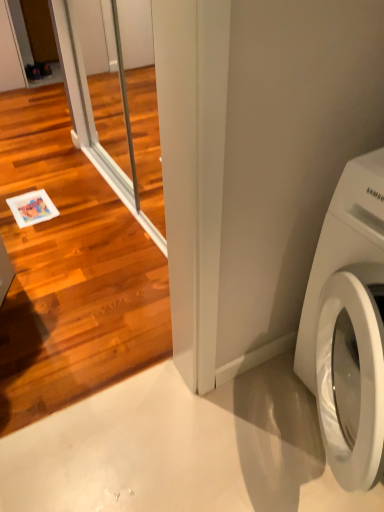
Where is `white glossy washing machine at lower right`? The height and width of the screenshot is (512, 384). white glossy washing machine at lower right is located at coordinates (348, 326).

Where is `clear glass screen door at left, positioned as the first screen door in back-to-front order`? clear glass screen door at left, positioned as the first screen door in back-to-front order is located at coordinates (115, 100).

Find the location of a particular element. This screenshot has width=384, height=512. white glossy washing machine at lower right is located at coordinates (348, 326).

From the picture: Is clear glass screen door at upper left, the 1th screen door positioned from the front, oriented away from clear glass screen door at left, arranged as the second screen door when viewed from the front?

Absolutely, clear glass screen door at upper left, the 1th screen door positioned from the front, is directed away from clear glass screen door at left, arranged as the second screen door when viewed from the front.

Which is nearer, (x=139, y=336) or (x=120, y=134)?

Point (x=139, y=336)

Looking at this image, considering the relative positions of clear glass screen door at upper left, which ranks as the second screen door in back-to-front order, and clear glass screen door at left, positioned as the first screen door in back-to-front order, in the image provided, is clear glass screen door at upper left, which ranks as the second screen door in back-to-front order, behind clear glass screen door at left, positioned as the first screen door in back-to-front order,?

No, clear glass screen door at upper left, which ranks as the second screen door in back-to-front order, is in front of clear glass screen door at left, positioned as the first screen door in back-to-front order.

Could you tell me if white glossy washing machine at lower right is turned towards clear glass screen door at left, positioned as the first screen door in back-to-front order?

No, white glossy washing machine at lower right is not oriented towards clear glass screen door at left, positioned as the first screen door in back-to-front order.

Is point (319, 373) positioned behind point (149, 116)?

That is False.

Is white glossy washing machine at lower right in contact with clear glass screen door at left, arranged as the second screen door when viewed from the front?

No.

Which of these two, white glossy washing machine at lower right or clear glass screen door at left, arranged as the second screen door when viewed from the front, is wider?

Wider between the two is white glossy washing machine at lower right.

From the image's perspective, is clear glass screen door at left, arranged as the second screen door when viewed from the front, located above or below clear glass screen door at upper left, the 1th screen door positioned from the front?

Based on their image positions, clear glass screen door at left, arranged as the second screen door when viewed from the front, is located above clear glass screen door at upper left, the 1th screen door positioned from the front.

Which object is closer to the camera, clear glass screen door at left, arranged as the second screen door when viewed from the front, or clear glass screen door at upper left, which ranks as the second screen door in back-to-front order?

clear glass screen door at upper left, which ranks as the second screen door in back-to-front order, is more forward.

Is clear glass screen door at left, arranged as the second screen door when viewed from the front, far from clear glass screen door at upper left, which ranks as the second screen door in back-to-front order?

No.

Is white glossy washing machine at lower right at the back of clear glass screen door at upper left, the 1th screen door positioned from the front?

No, clear glass screen door at upper left, the 1th screen door positioned from the front,'s orientation is not away from white glossy washing machine at lower right.

From a real-world perspective, relative to white glossy washing machine at lower right, is clear glass screen door at upper left, which ranks as the second screen door in back-to-front order, vertically above or below?

clear glass screen door at upper left, which ranks as the second screen door in back-to-front order, is above white glossy washing machine at lower right.

Which is in front, point (3, 198) or point (346, 272)?

Positioned in front is point (346, 272).

Which object is positioned more to the right, clear glass screen door at upper left, the 1th screen door positioned from the front, or white glossy washing machine at lower right?

Positioned to the right is white glossy washing machine at lower right.

In the scene shown: Is white glossy washing machine at lower right positioned before clear glass screen door at upper left, which ranks as the second screen door in back-to-front order?

No.

From a real-world perspective, between white glossy washing machine at lower right and clear glass screen door at upper left, the 1th screen door positioned from the front, who is vertically lower?

white glossy washing machine at lower right is physically lower.

Is white glossy washing machine at lower right not inside clear glass screen door at upper left, the 1th screen door positioned from the front?

Yes, white glossy washing machine at lower right is located beyond the bounds of clear glass screen door at upper left, the 1th screen door positioned from the front.

Between white glossy washing machine at lower right and clear glass screen door at upper left, which ranks as the second screen door in back-to-front order, which one has more height?

Standing taller between the two is clear glass screen door at upper left, which ranks as the second screen door in back-to-front order.

Is clear glass screen door at left, arranged as the second screen door when viewed from the front, shorter than white glossy washing machine at lower right?

No.

Which is more to the right, clear glass screen door at left, positioned as the first screen door in back-to-front order, or white glossy washing machine at lower right?

Positioned to the right is white glossy washing machine at lower right.

Between clear glass screen door at left, arranged as the second screen door when viewed from the front, and white glossy washing machine at lower right, which one has smaller width?

Thinner between the two is clear glass screen door at left, arranged as the second screen door when viewed from the front.

From a real-world perspective, is clear glass screen door at left, positioned as the first screen door in back-to-front order, over white glossy washing machine at lower right?

Yes, from a real-world perspective, clear glass screen door at left, positioned as the first screen door in back-to-front order, is on top of white glossy washing machine at lower right.

The height and width of the screenshot is (512, 384). Identify the location of screen door behind the clear glass screen door at upper left, the 1th screen door positioned from the front. (115, 100).

Find the location of a particular element. This screenshot has width=384, height=512. screen door that is the 2nd one when counting leftward from the white glossy washing machine at lower right is located at coordinates (115, 100).

Looking at the image, which one is located further to clear glass screen door at left, positioned as the first screen door in back-to-front order, clear glass screen door at upper left, which ranks as the second screen door in back-to-front order, or white glossy washing machine at lower right?

Based on the image, white glossy washing machine at lower right appears to be further to clear glass screen door at left, positioned as the first screen door in back-to-front order.

Estimate the real-world distances between objects in this image. Which object is closer to clear glass screen door at left, positioned as the first screen door in back-to-front order, white glossy washing machine at lower right or clear glass screen door at upper left, the 1th screen door positioned from the front?

The object closer to clear glass screen door at left, positioned as the first screen door in back-to-front order, is clear glass screen door at upper left, the 1th screen door positioned from the front.

Based on their spatial positions, is clear glass screen door at left, positioned as the first screen door in back-to-front order, or clear glass screen door at upper left, the 1th screen door positioned from the front, closer to white glossy washing machine at lower right?

clear glass screen door at upper left, the 1th screen door positioned from the front, lies closer to white glossy washing machine at lower right than the other object.

Looking at the image, which one is located closer to clear glass screen door at upper left, which ranks as the second screen door in back-to-front order, white glossy washing machine at lower right or clear glass screen door at left, arranged as the second screen door when viewed from the front?

clear glass screen door at left, arranged as the second screen door when viewed from the front.

Considering their positions, is clear glass screen door at upper left, which ranks as the second screen door in back-to-front order, positioned further to white glossy washing machine at lower right than clear glass screen door at left, positioned as the first screen door in back-to-front order?

Based on the image, clear glass screen door at left, positioned as the first screen door in back-to-front order, appears to be further to white glossy washing machine at lower right.

Based on their spatial positions, is clear glass screen door at left, arranged as the second screen door when viewed from the front, or white glossy washing machine at lower right further from clear glass screen door at upper left, which ranks as the second screen door in back-to-front order?

white glossy washing machine at lower right is positioned further to the anchor clear glass screen door at upper left, which ranks as the second screen door in back-to-front order.

This screenshot has width=384, height=512. In order to click on screen door between clear glass screen door at left, positioned as the first screen door in back-to-front order, and white glossy washing machine at lower right vertically in this screenshot , I will do (x=83, y=238).